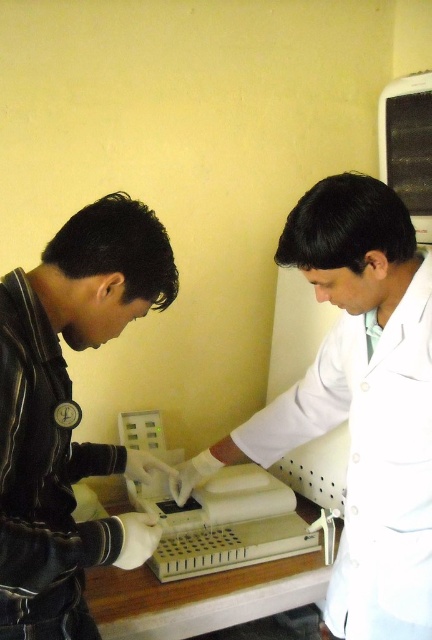
You are a researcher who needs to retrieve the white plastic test tubes at center from the lab equipment. However, your hands are currently wearing the white matte gloves at left. Will you be able to reach the test tubes without removing the gloves?

The white matte gloves at left is in front of the white plastic test tubes at center, so you can reach the test tubes without removing the gloves since the gloves are positioned closer to you than the test tubes.

You are a visitor in the lab and need to hand over the white plastic test tubes at center to the person in the white lab coat at center. Can you directly hand them to the person without moving the test tubes?

The white lab coat at center is in front of the white plastic test tubes at center, so the person in the white lab coat at center can directly reach and take the test tubes without needing to move them.